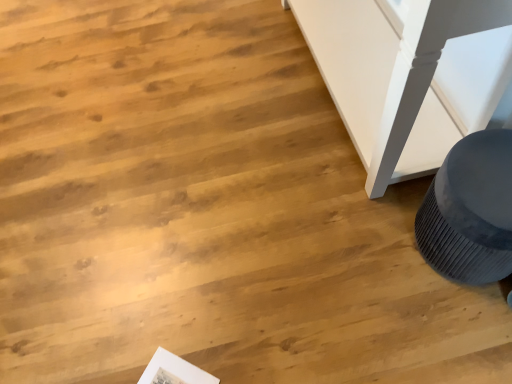
Question: Does matte gray speaker at lower right have a larger size compared to white paper at lower left?

Choices:
 (A) yes
 (B) no

Answer: (A)

Question: Does matte gray speaker at lower right have a smaller size compared to white paper at lower left?

Choices:
 (A) no
 (B) yes

Answer: (A)

Question: Is matte gray speaker at lower right thinner than white paper at lower left?

Choices:
 (A) yes
 (B) no

Answer: (B)

Question: Is matte gray speaker at lower right next to white paper at lower left and touching it?

Choices:
 (A) no
 (B) yes

Answer: (A)

Question: Can you confirm if matte gray speaker at lower right is positioned to the left of white paper at lower left?

Choices:
 (A) yes
 (B) no

Answer: (B)

Question: Is matte gray speaker at lower right to the right of white paper at lower left from the viewer's perspective?

Choices:
 (A) yes
 (B) no

Answer: (A)

Question: Does white paper at lower left have a greater height compared to matte gray speaker at lower right?

Choices:
 (A) yes
 (B) no

Answer: (B)

Question: Is white paper at lower left in front of matte gray speaker at lower right?

Choices:
 (A) yes
 (B) no

Answer: (B)

Question: Are white paper at lower left and matte gray speaker at lower right making contact?

Choices:
 (A) no
 (B) yes

Answer: (A)

Question: Considering the relative sizes of white paper at lower left and matte gray speaker at lower right in the image provided, is white paper at lower left shorter than matte gray speaker at lower right?

Choices:
 (A) no
 (B) yes

Answer: (B)

Question: Can you confirm if white paper at lower left is thinner than matte gray speaker at lower right?

Choices:
 (A) no
 (B) yes

Answer: (B)

Question: From a real-world perspective, is white paper at lower left on top of matte gray speaker at lower right?

Choices:
 (A) yes
 (B) no

Answer: (B)

Question: Looking at their shapes, would you say matte gray speaker at lower right is wider or thinner than white paper at lower left?

Choices:
 (A) thin
 (B) wide

Answer: (B)